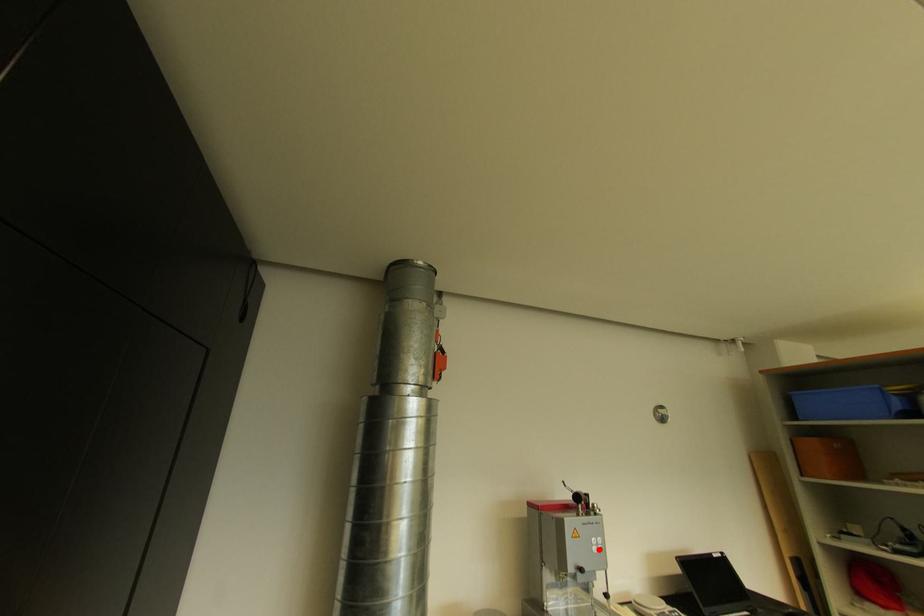
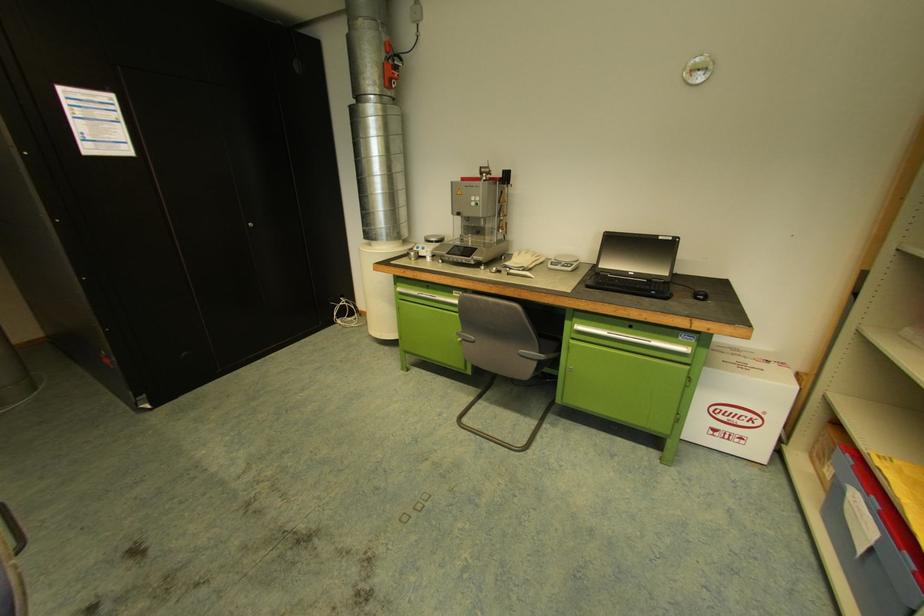
Question: I am providing you with two images of the same scene from different viewpoints. A red point is shown in image1. For the corresponding object point in image2, is it positioned nearer or farther from the camera?

Choices:
 (A) Nearer
 (B) Farther

Answer: (A)